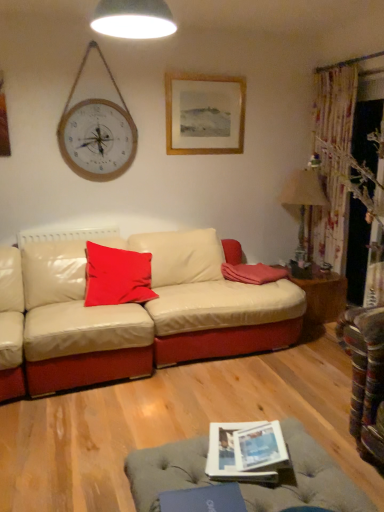
What are the coordinates of `free point below beige fabric lampshade at right, the second lamp viewed from the front (from a real-world perspective)` in the screenshot? It's located at (307, 268).